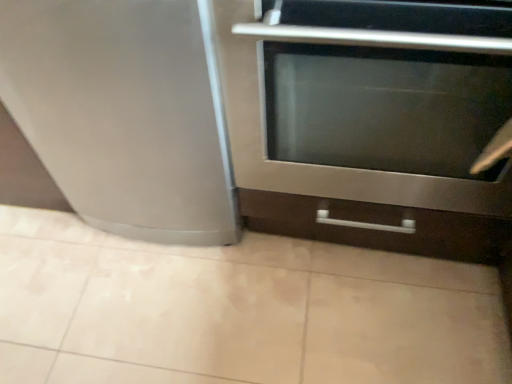
Image resolution: width=512 pixels, height=384 pixels. I want to click on beige ceramic tile at lower center, so click(x=237, y=311).

What is the approximate height of beige ceramic tile at lower center?

beige ceramic tile at lower center is 1.45 inches in height.

What do you see at coordinates (370, 121) in the screenshot?
I see `stainless steel oven at center` at bounding box center [370, 121].

The image size is (512, 384). Find the location of `beige ceramic tile at lower center`. beige ceramic tile at lower center is located at coordinates (237, 311).

Considering the relative positions of satin silver refrigerator at left and stainless steel oven at center in the image provided, is satin silver refrigerator at left to the right of stainless steel oven at center from the viewer's perspective?

Incorrect, satin silver refrigerator at left is not on the right side of stainless steel oven at center.

Looking at this image, between satin silver refrigerator at left and stainless steel oven at center, which one has larger size?

With larger size is stainless steel oven at center.

Which of these two, beige ceramic tile at lower center or satin silver refrigerator at left, is thinner?

satin silver refrigerator at left is thinner.

Is beige ceramic tile at lower center looking in the opposite direction of satin silver refrigerator at left?

That's not correct — beige ceramic tile at lower center is not looking away from satin silver refrigerator at left.

From the image's perspective, is beige ceramic tile at lower center located beneath satin silver refrigerator at left?

Correct, beige ceramic tile at lower center appears lower than satin silver refrigerator at left in the image.

Is beige ceramic tile at lower center positioned beyond the bounds of satin silver refrigerator at left?

Yes, beige ceramic tile at lower center is not within satin silver refrigerator at left.

Is beige ceramic tile at lower center inside or outside of stainless steel oven at center?

beige ceramic tile at lower center is not enclosed by stainless steel oven at center.

Visually, is beige ceramic tile at lower center positioned to the left or to the right of stainless steel oven at center?

In the image, beige ceramic tile at lower center appears on the left side of stainless steel oven at center.

Considering the sizes of beige ceramic tile at lower center and stainless steel oven at center in the image, is beige ceramic tile at lower center taller or shorter than stainless steel oven at center?

Clearly, beige ceramic tile at lower center is shorter compared to stainless steel oven at center.

From a real-world perspective, who is located lower, beige ceramic tile at lower center or stainless steel oven at center?

From a 3D spatial view, beige ceramic tile at lower center is below.

Considering the relative sizes of stainless steel oven at center and satin silver refrigerator at left in the image provided, is stainless steel oven at center thinner than satin silver refrigerator at left?

Yes, stainless steel oven at center is thinner than satin silver refrigerator at left.

Do you think stainless steel oven at center is within satin silver refrigerator at left, or outside of it?

stainless steel oven at center cannot be found inside satin silver refrigerator at left.

Based on the photo, can you confirm if stainless steel oven at center is smaller than satin silver refrigerator at left?

No.

From the image's perspective, is stainless steel oven at center above or below satin silver refrigerator at left?

From the image's perspective, stainless steel oven at center appears below satin silver refrigerator at left.

How many degrees apart are the facing directions of stainless steel oven at center and beige ceramic tile at lower center?

91.6 degrees separate the facing orientations of stainless steel oven at center and beige ceramic tile at lower center.

From the picture: Measure the distance between stainless steel oven at center and beige ceramic tile at lower center.

stainless steel oven at center is 15.83 inches away from beige ceramic tile at lower center.

Do you think stainless steel oven at center is within beige ceramic tile at lower center, or outside of it?

stainless steel oven at center is located beyond the bounds of beige ceramic tile at lower center.

Between stainless steel oven at center and beige ceramic tile at lower center, which one has smaller size?

Smaller between the two is beige ceramic tile at lower center.

Which is in front, point (94, 4) or point (369, 381)?

The point (94, 4) is more forward.

Looking at this image, from the image's perspective, which one is positioned higher, satin silver refrigerator at left or beige ceramic tile at lower center?

satin silver refrigerator at left.

Which object is closer to the camera, satin silver refrigerator at left or beige ceramic tile at lower center?

satin silver refrigerator at left is closer to the camera.

Does satin silver refrigerator at left have a larger size compared to beige ceramic tile at lower center?

Indeed, satin silver refrigerator at left has a larger size compared to beige ceramic tile at lower center.

Find the location of a particular element. This screenshot has width=512, height=384. oven that is on the right side of satin silver refrigerator at left is located at coordinates (370, 121).

The image size is (512, 384). In order to click on appliance on the left of beige ceramic tile at lower center in this screenshot , I will do `click(124, 113)`.

From the image, which object appears to be farther from satin silver refrigerator at left, stainless steel oven at center or beige ceramic tile at lower center?

beige ceramic tile at lower center.

Considering their positions, is beige ceramic tile at lower center positioned further to satin silver refrigerator at left than stainless steel oven at center?

Based on the image, beige ceramic tile at lower center appears to be further to satin silver refrigerator at left.

When comparing their distances from beige ceramic tile at lower center, does satin silver refrigerator at left or stainless steel oven at center seem closer?

stainless steel oven at center is positioned closer to the anchor beige ceramic tile at lower center.

Considering their positions, is stainless steel oven at center positioned closer to beige ceramic tile at lower center than satin silver refrigerator at left?

Based on the image, stainless steel oven at center appears to be nearer to beige ceramic tile at lower center.

Considering their positions, is beige ceramic tile at lower center positioned further to stainless steel oven at center than satin silver refrigerator at left?

Based on the image, beige ceramic tile at lower center appears to be further to stainless steel oven at center.

Which object lies nearer to the anchor point stainless steel oven at center, satin silver refrigerator at left or beige ceramic tile at lower center?

satin silver refrigerator at left is positioned closer to the anchor stainless steel oven at center.

This screenshot has width=512, height=384. I want to click on oven between satin silver refrigerator at left and beige ceramic tile at lower center in the vertical direction, so click(370, 121).